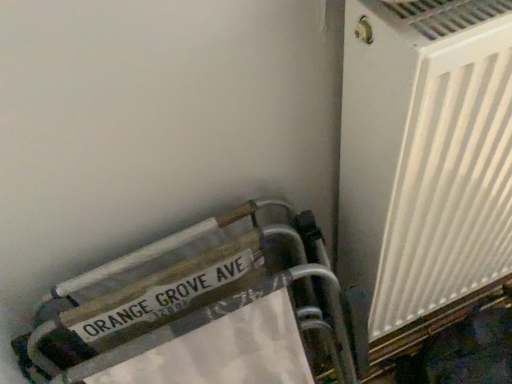
Question: Should I look upward or downward to see white plastic radiator at right?

Choices:
 (A) down
 (B) up

Answer: (B)

Question: Considering the relative sizes of white plastic radiator at right and wooden sign at lower left in the image provided, is white plastic radiator at right smaller than wooden sign at lower left?

Choices:
 (A) no
 (B) yes

Answer: (A)

Question: Considering the relative sizes of white plastic radiator at right and wooden sign at lower left in the image provided, is white plastic radiator at right bigger than wooden sign at lower left?

Choices:
 (A) no
 (B) yes

Answer: (B)

Question: Is the depth of white plastic radiator at right less than that of wooden sign at lower left?

Choices:
 (A) yes
 (B) no

Answer: (A)

Question: Is white plastic radiator at right taller than wooden sign at lower left?

Choices:
 (A) no
 (B) yes

Answer: (B)

Question: Is white plastic radiator at right facing away from wooden sign at lower left?

Choices:
 (A) no
 (B) yes

Answer: (A)

Question: Are white plastic radiator at right and wooden sign at lower left beside each other?

Choices:
 (A) no
 (B) yes

Answer: (A)

Question: Is wooden sign at lower left taller than white plastic radiator at right?

Choices:
 (A) yes
 (B) no

Answer: (B)

Question: Does wooden sign at lower left have a lesser width compared to white plastic radiator at right?

Choices:
 (A) no
 (B) yes

Answer: (B)

Question: Is the surface of wooden sign at lower left in direct contact with white plastic radiator at right?

Choices:
 (A) no
 (B) yes

Answer: (A)

Question: Is wooden sign at lower left positioned beyond the bounds of white plastic radiator at right?

Choices:
 (A) no
 (B) yes

Answer: (B)

Question: From a real-world perspective, is wooden sign at lower left over white plastic radiator at right?

Choices:
 (A) no
 (B) yes

Answer: (A)

Question: Is wooden sign at lower left positioned in front of white plastic radiator at right?

Choices:
 (A) yes
 (B) no

Answer: (B)

Question: From a real-world perspective, is wooden sign at lower left positioned above or below white plastic radiator at right?

Choices:
 (A) above
 (B) below

Answer: (B)